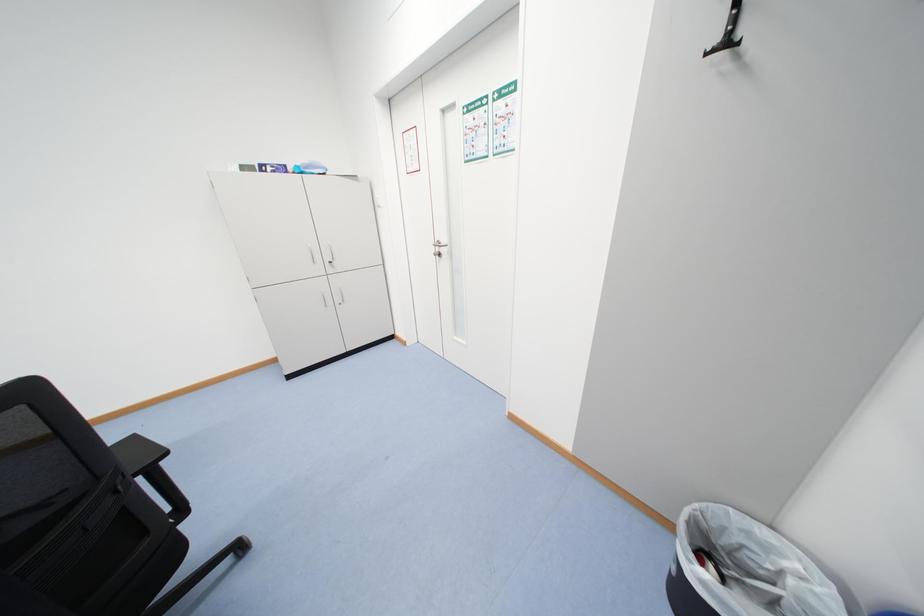
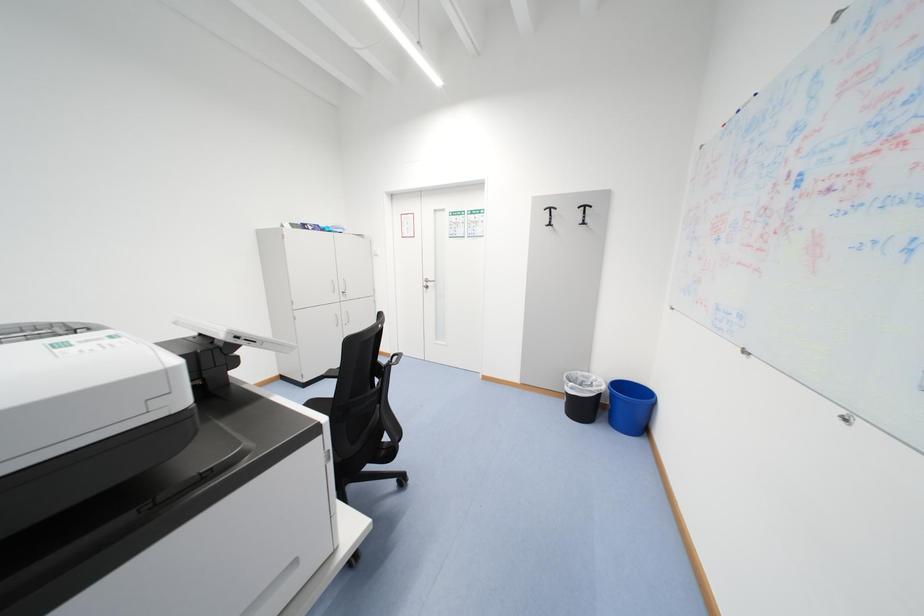
Which direction would the cameraman need to move to produce the second image?

The movement direction of the cameraman is left, backward.